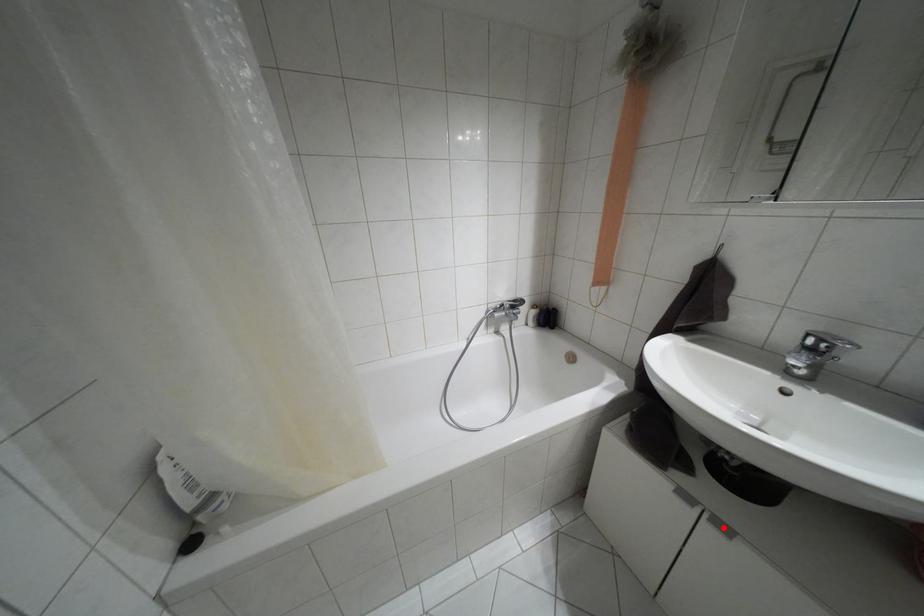
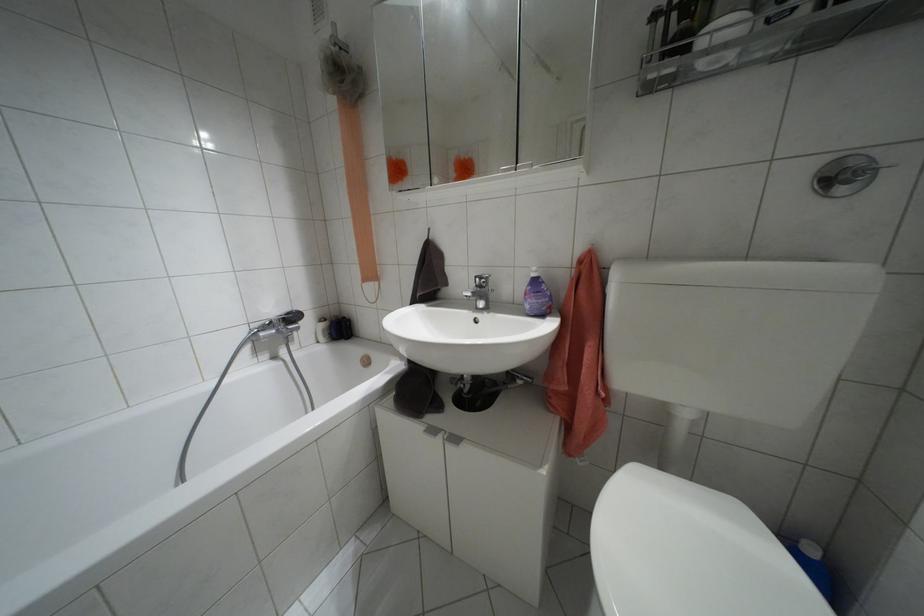
Find the pixel in the second image that matches the highlighted location in the first image.

(455, 439)